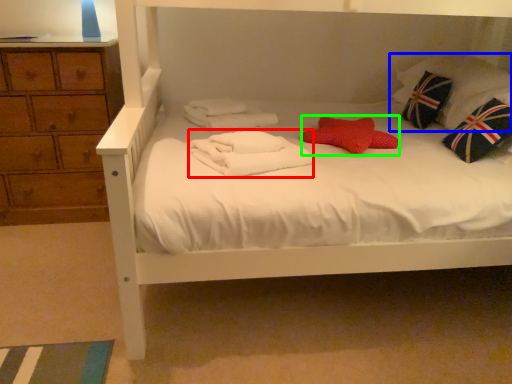
Question: Based on their relative distances, which object is farther from bath towel (highlighted by a red box)? Choose from pillow (highlighted by a blue box) and pillow (highlighted by a green box).

Choices:
 (A) pillow
 (B) pillow

Answer: (A)